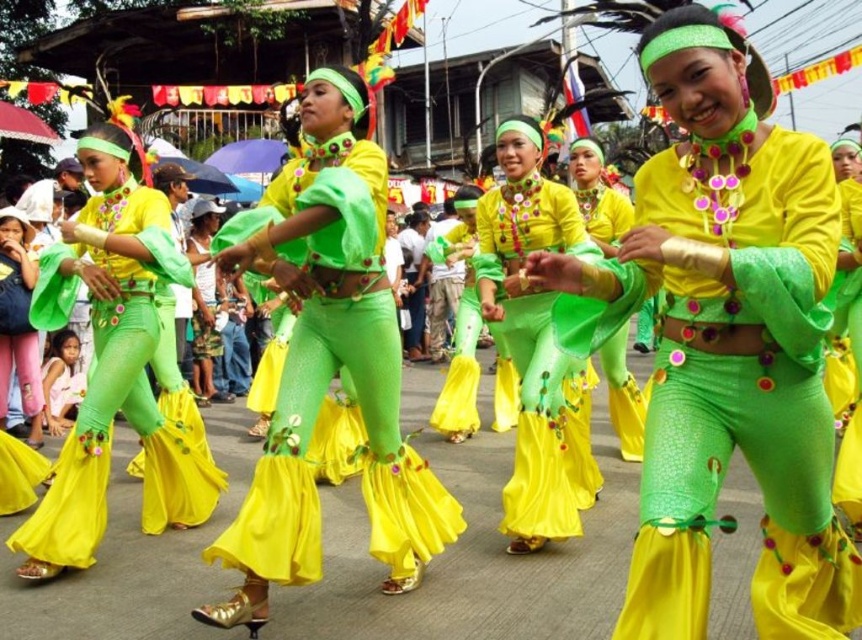
Question: Which object appears closest to the camera in this image?

Choices:
 (A) shiny green fabric skirt at center
 (B) matte green fabric at lower left
 (C) shiny green fabric dress at center

Answer: (C)

Question: Is the position of green textured fabric at center more distant than that of matte green fabric at lower left?

Choices:
 (A) no
 (B) yes

Answer: (A)

Question: Estimate the real-world distances between objects in this image. Which object is closer to the matte green fabric at lower left?

Choices:
 (A) green textured fabric at center
 (B) shiny green fabric skirt at center

Answer: (B)

Question: Which point is closer to the camera?

Choices:
 (A) tap(678, 349)
 (B) tap(314, 141)
 (C) tap(536, 387)

Answer: (A)

Question: Does shiny green fabric skirt at left appear on the right side of shiny green fabric skirt at center?

Choices:
 (A) yes
 (B) no

Answer: (B)

Question: Can you confirm if shiny green fabric skirt at left is positioned below matte green fabric at lower left?

Choices:
 (A) yes
 (B) no

Answer: (A)